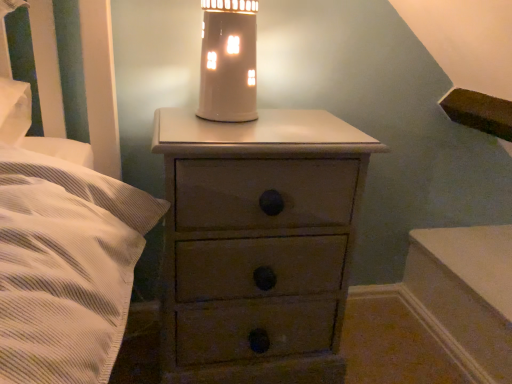
I want to click on vacant space to the right of matte white oil lamp at upper center, so click(302, 127).